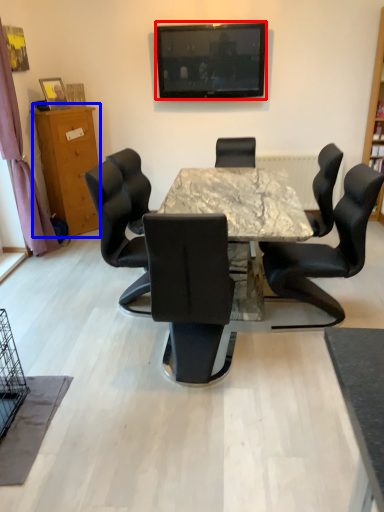
Question: Which object appears closest to the camera in this image, television (highlighted by a red box) or cabinetry (highlighted by a blue box)?

Choices:
 (A) television
 (B) cabinetry

Answer: (B)